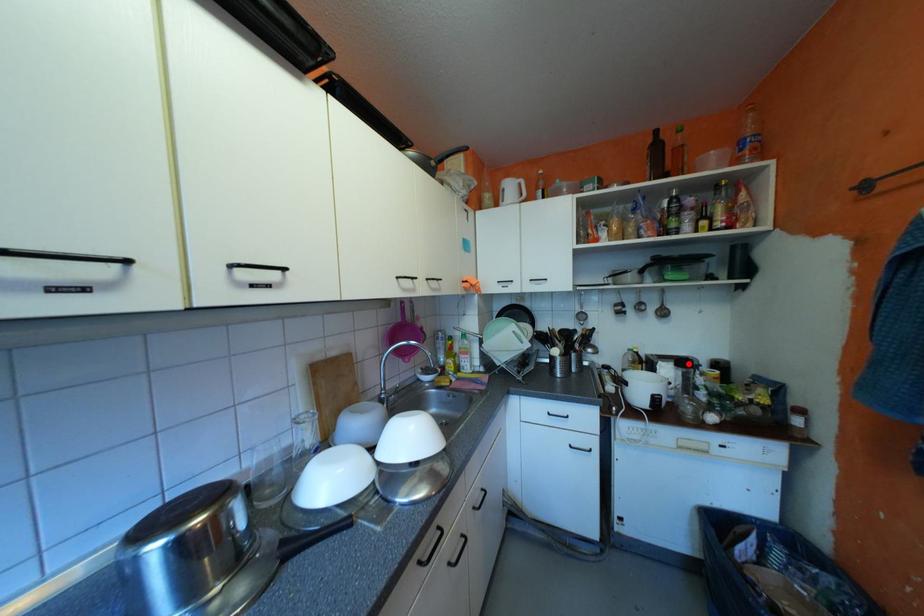
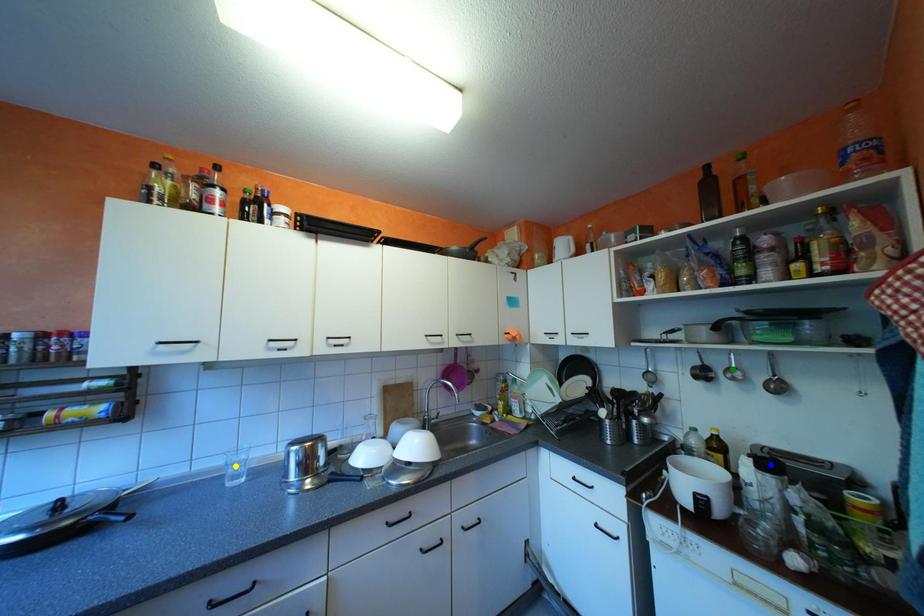
Question: I am providing you with two images of the same scene from different viewpoints. A red point is marked on the first image. You are given multiple points on the second image. Which mark in image 2 goes with the point in image 1?

Choices:
 (A) yellow point
 (B) green point
 (C) blue point

Answer: (C)